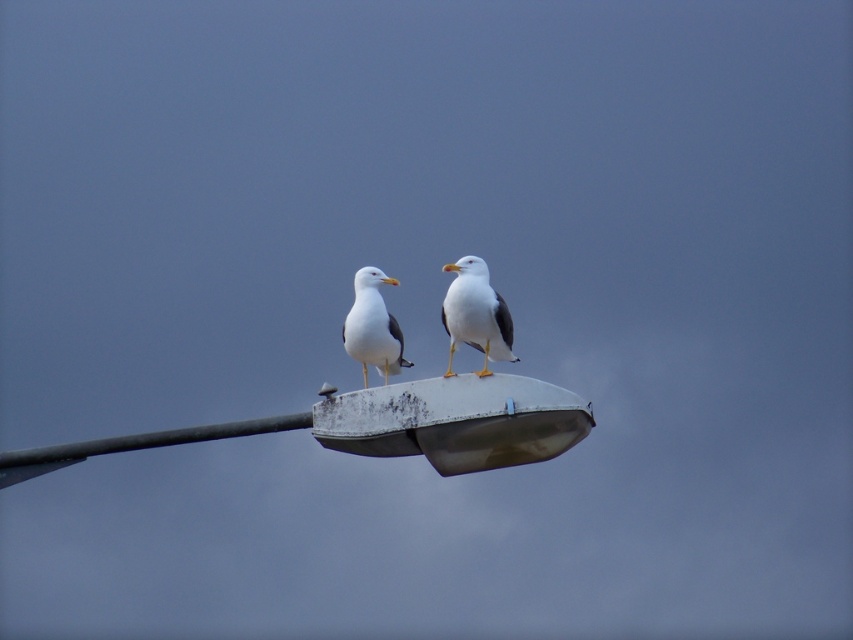
Question: Among these objects, which one is farthest from the camera?

Choices:
 (A) white matte seagull at center
 (B) white matte seagull at upper center

Answer: (A)

Question: Among these objects, which one is nearest to the camera?

Choices:
 (A) white matte seagull at center
 (B) white matte seagull at upper center

Answer: (B)

Question: Is white matte seagull at upper center to the left of white matte seagull at center from the viewer's perspective?

Choices:
 (A) no
 (B) yes

Answer: (A)

Question: Does white matte seagull at upper center appear on the left side of white matte seagull at center?

Choices:
 (A) yes
 (B) no

Answer: (B)

Question: Can you confirm if white matte seagull at upper center is bigger than white matte seagull at center?

Choices:
 (A) no
 (B) yes

Answer: (A)

Question: Which point is closer to the camera?

Choices:
 (A) (444, 305)
 (B) (354, 340)

Answer: (A)